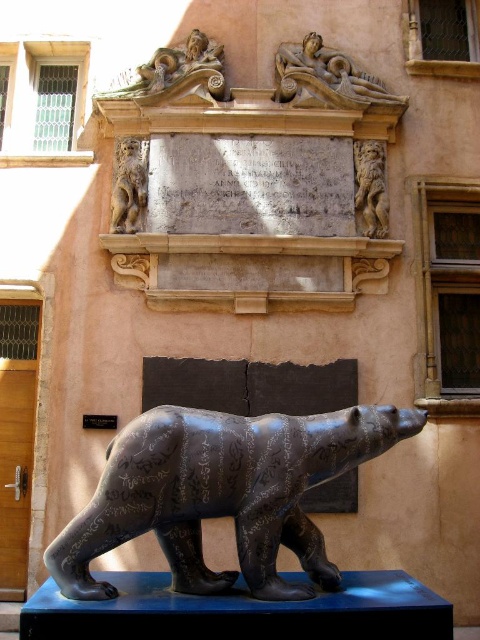
You are an architect examining the historical site. You need to locate the polished stone relief at upper center. Where exactly is it positioned in the image?

The polished stone relief at upper center is located at point coordinates of (x=177, y=72).

You are an art student analyzing the historical site. You notice the matte stone lion at upper left and the black stone plaque at center. Which object is positioned to the right of the other?

The matte stone lion at upper left is positioned to the right of the black stone plaque at center.